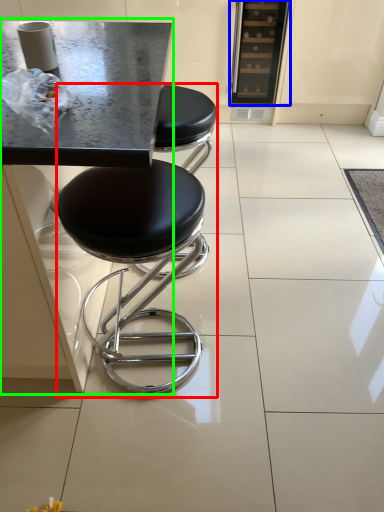
Question: Based on their relative distances, which object is farther from stool (highlighted by a red box)? Choose from appliance (highlighted by a blue box) and round table (highlighted by a green box).

Choices:
 (A) appliance
 (B) round table

Answer: (A)